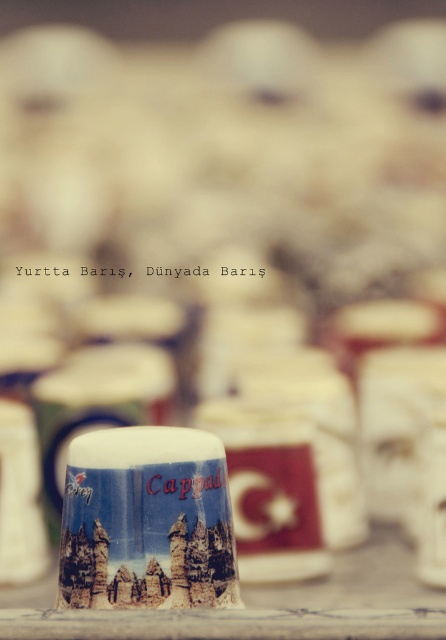
Can you confirm if blue glossy mug at center is shorter than wooden table at center?

In fact, blue glossy mug at center may be taller than wooden table at center.

Is blue glossy mug at center taller than wooden table at center?

Indeed, blue glossy mug at center has a greater height compared to wooden table at center.

Is point (169, 589) closer to viewer compared to point (106, 630)?

That is False.

At what (x,y) coordinates should I click in order to perform the action: click on blue glossy mug at center. Please return your answer as a coordinate pair (x, y). This screenshot has height=640, width=446. Looking at the image, I should click on (147, 520).

Is blue glossy mug at center bigger than matte ceramic mug at center?

No.

Does blue glossy mug at center appear over matte ceramic mug at center?

Yes, blue glossy mug at center is above matte ceramic mug at center.

Locate an element on the screen. blue glossy mug at center is located at coordinates (147, 520).

Can you confirm if wooden table at center is positioned below matte ceramic mug at center?

Correct, wooden table at center is located below matte ceramic mug at center.

Is wooden table at center to the right of matte ceramic mug at center from the viewer's perspective?

Incorrect, wooden table at center is not on the right side of matte ceramic mug at center.

I want to click on wooden table at center, so coord(260,605).

The image size is (446, 640). Identify the location of wooden table at center. pyautogui.click(x=260, y=605).